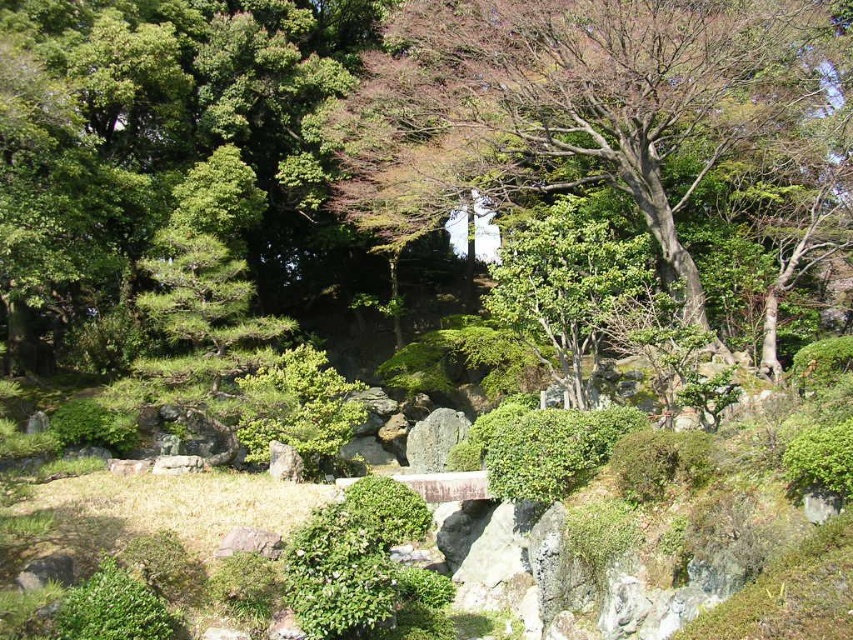
Is green leafy tree at upper center shorter than green mossy rock at center?

In fact, green leafy tree at upper center may be taller than green mossy rock at center.

Between green leafy tree at upper center and green mossy rock at center, which one has less height?

Standing shorter between the two is green mossy rock at center.

I want to click on green leafy tree at upper center, so click(x=601, y=116).